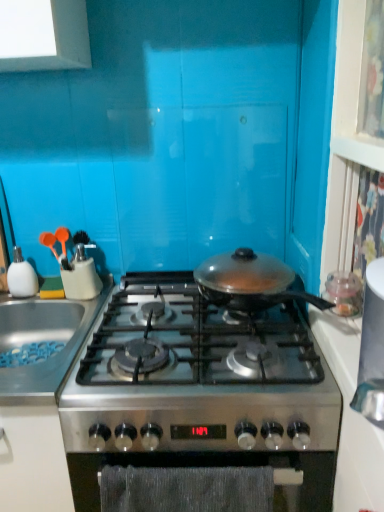
The width and height of the screenshot is (384, 512). I want to click on empty space that is ontop of white glossy countertop at right (from a real-world perspective), so [x=346, y=328].